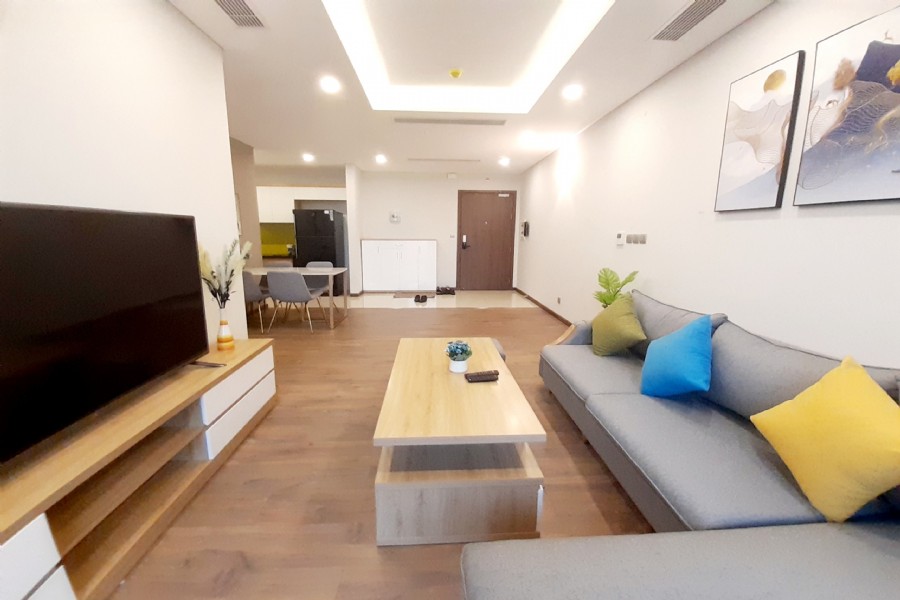
The width and height of the screenshot is (900, 600). What are the coordinates of `yellow pillow` in the screenshot? It's located at (841, 440).